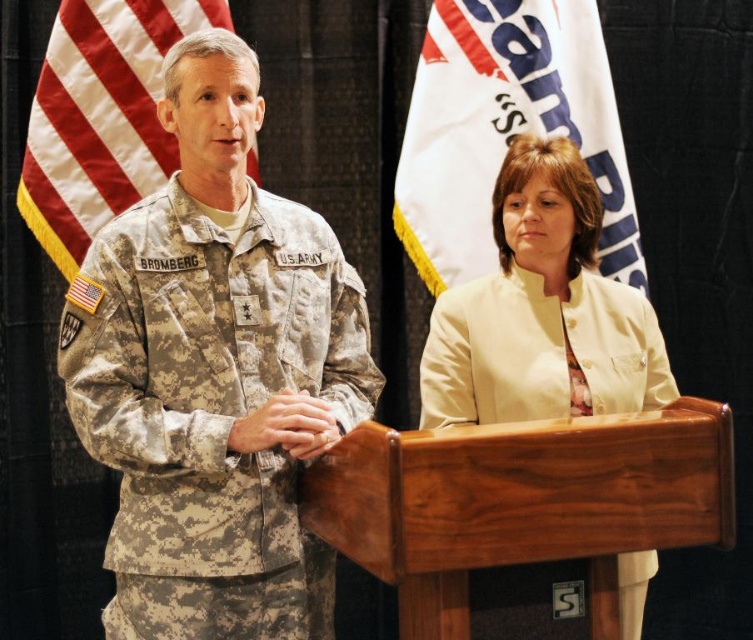
Between camouflage uniform at center and matte yellow jacket at center, which one has more height?

Standing taller between the two is camouflage uniform at center.

The image size is (753, 640). What do you see at coordinates (215, 372) in the screenshot? I see `camouflage uniform at center` at bounding box center [215, 372].

At what (x,y) coordinates should I click in order to perform the action: click on camouflage uniform at center. Please return your answer as a coordinate pair (x, y). Looking at the image, I should click on (215, 372).

Which is behind, point (248, 346) or point (188, 29)?

Positioned behind is point (188, 29).

Does camouflage uniform at center have a lesser height compared to camouflage fabric flag at left?

Incorrect, camouflage uniform at center's height does not fall short of camouflage fabric flag at left's.

Describe the element at coordinates (215, 372) in the screenshot. This screenshot has height=640, width=753. I see `camouflage uniform at center` at that location.

Where is `camouflage uniform at center`? camouflage uniform at center is located at coordinates (215, 372).

Which is more to the right, white fabric flag at upper center or camouflage fabric flag at left?

white fabric flag at upper center is more to the right.

Between point (486, 195) and point (148, 177), which one is positioned in front?

Point (148, 177) is more forward.

Identify the location of white fabric flag at upper center. (505, 129).